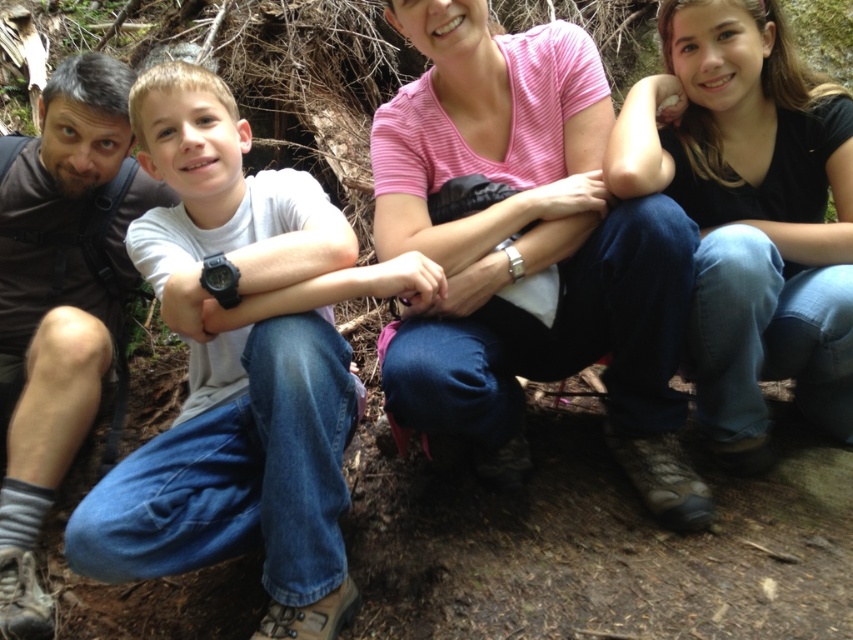
Is pink striped shirt at center thinner than blue jeans at lower right?

No, pink striped shirt at center is not thinner than blue jeans at lower right.

Which is in front, point (520, 266) or point (782, 301)?

Positioned in front is point (520, 266).

The height and width of the screenshot is (640, 853). Describe the element at coordinates (531, 250) in the screenshot. I see `pink striped shirt at center` at that location.

Locate an element on the screen. The width and height of the screenshot is (853, 640). pink striped shirt at center is located at coordinates (531, 250).

Does white matte shirt at center have a greater height compared to pink striped shirt at center?

Yes.

Can you confirm if white matte shirt at center is wider than pink striped shirt at center?

In fact, white matte shirt at center might be narrower than pink striped shirt at center.

This screenshot has width=853, height=640. In order to click on white matte shirt at center in this screenshot , I will do `click(241, 368)`.

Which is below, white matte shirt at center or blue jeans at lower right?

white matte shirt at center

Does point (155, 113) lie behind point (816, 348)?

No, it is not.

At what (x,y) coordinates should I click in order to perform the action: click on white matte shirt at center. Please return your answer as a coordinate pair (x, y). Looking at the image, I should click on (241, 368).